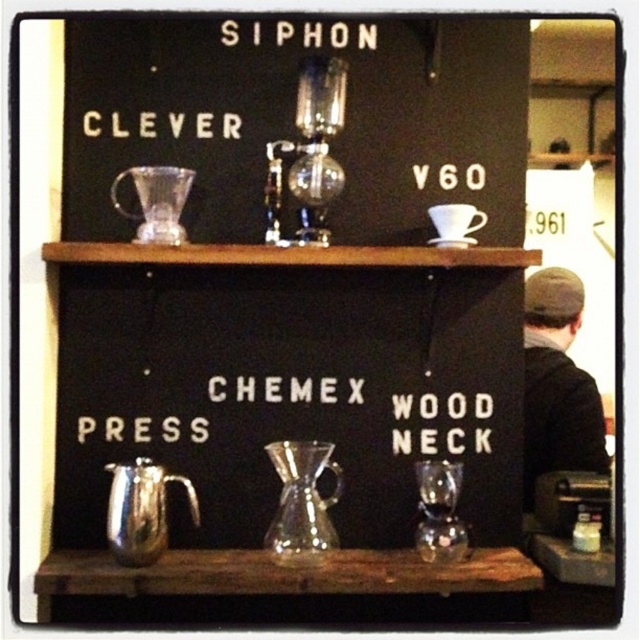
Question: Which point appears farthest from the camera in this image?

Choices:
 (A) (465, 230)
 (B) (525, 371)

Answer: (B)

Question: In this image, where is clear glass carafe at center located relative to white ceramic cup at upper center?

Choices:
 (A) above
 (B) below

Answer: (A)

Question: In this image, where is clear glass carafe at center located relative to white ceramic cup at upper center?

Choices:
 (A) left
 (B) right

Answer: (A)

Question: Among these points, which one is nearest to the camera?

Choices:
 (A) (545, 472)
 (B) (147, 422)
 (C) (65, 83)

Answer: (B)

Question: Based on their relative distances, which object is farther from the clear glass carafe at center?

Choices:
 (A) white plastic chemex press at center
 (B) dark gray knit cap at right
 (C) clear glass carafe at upper center

Answer: (B)

Question: Can you confirm if clear glass carafe at upper center is positioned to the right of dark gray knit cap at right?

Choices:
 (A) no
 (B) yes

Answer: (A)